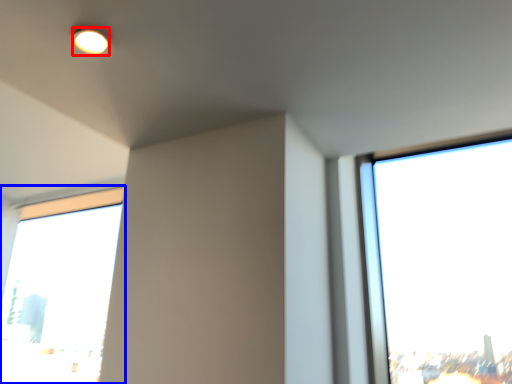
Question: Which object is further to the camera taking this photo, lighting (highlighted by a red box) or window (highlighted by a blue box)?

Choices:
 (A) lighting
 (B) window

Answer: (B)